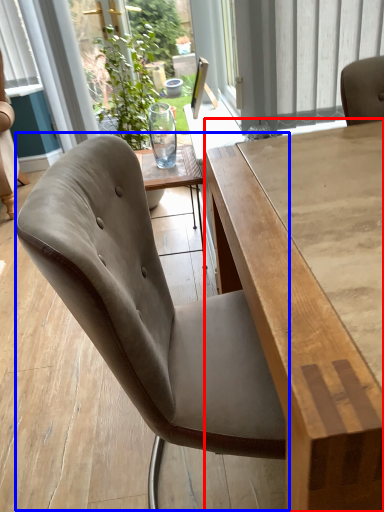
Question: Which point is further to the camera, table (highlighted by a red box) or chair (highlighted by a blue box)?

Choices:
 (A) table
 (B) chair

Answer: (B)